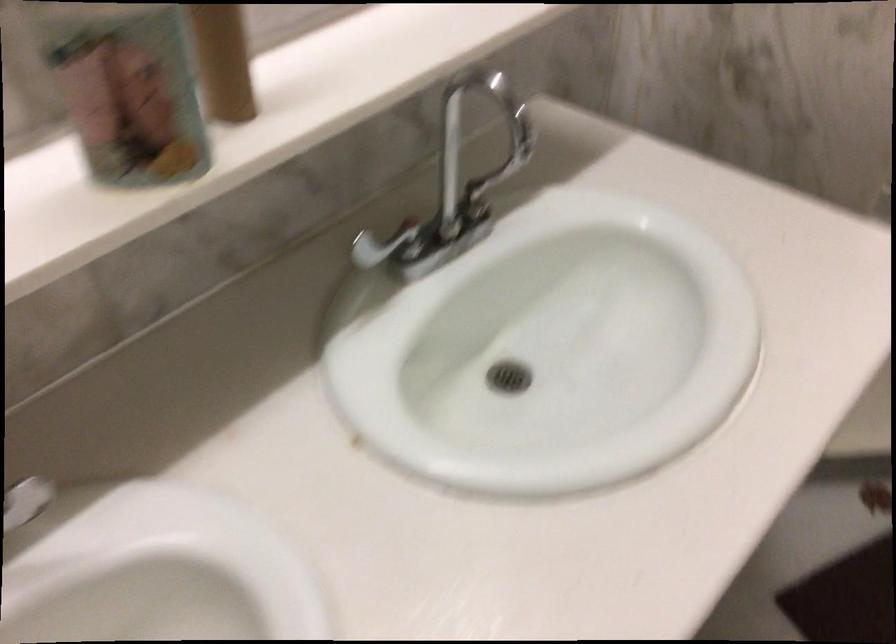
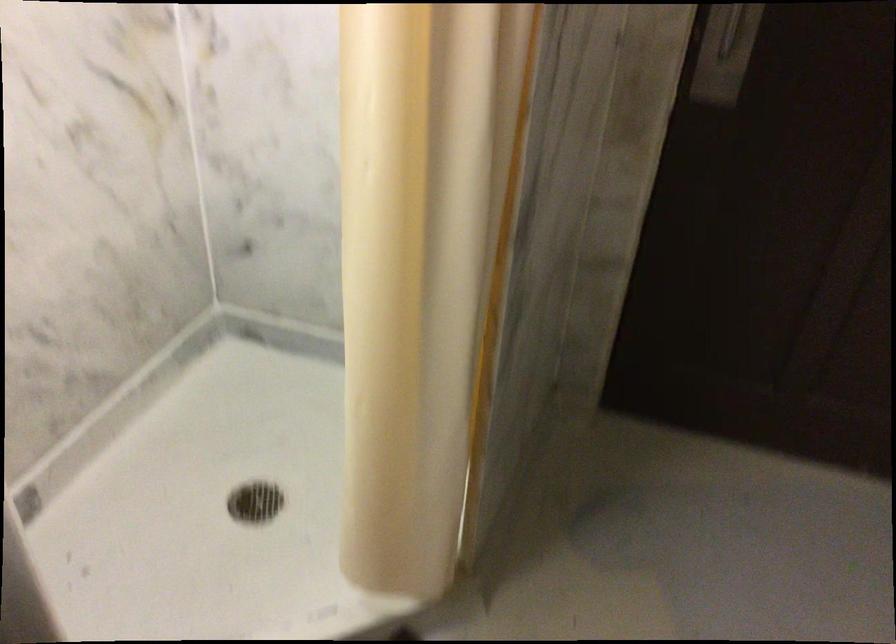
Question: The images are taken continuously from a first-person perspective. In which direction is your viewpoint rotating?

Choices:
 (A) Left
 (B) Right
 (C) Up
 (D) Down

Answer: (B)